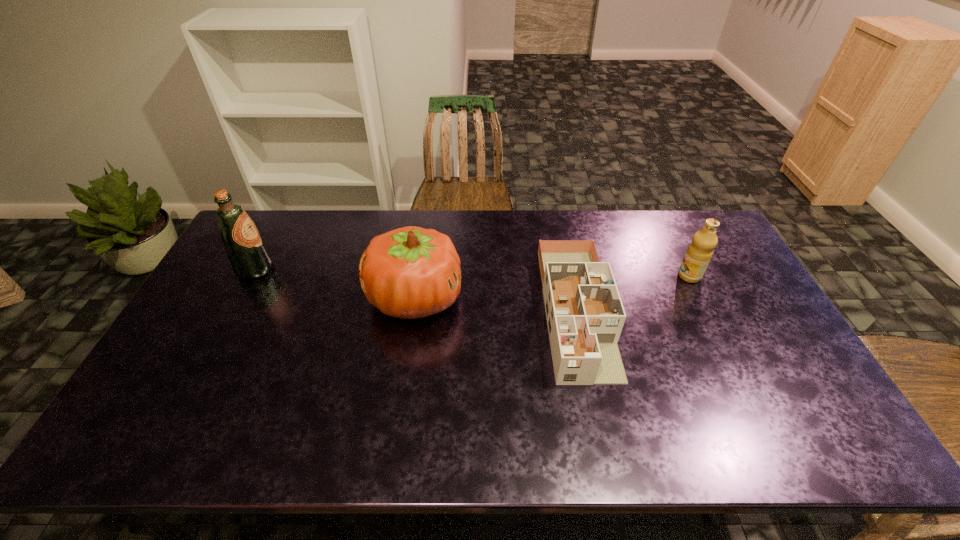
I want to click on free space located 0.200m on the label of the rightmost object, so click(x=616, y=276).

The height and width of the screenshot is (540, 960). What are the coordinates of `free space located 0.170m on the label of the rightmost object` in the screenshot? It's located at (626, 276).

At what (x,y) coordinates should I click in order to perform the action: click on free spot located 0.100m at the entrance of the third object from left to right. Please return your answer as a coordinate pair (x, y). Looking at the image, I should click on (600, 421).

Identify the location of object that is positioned at the left edge. (249, 256).

Find the location of a particular element. The image size is (960, 540). object located in the right edge section of the desktop is located at coordinates (699, 253).

This screenshot has height=540, width=960. Identify the location of free space at the far edge. (403, 220).

Locate an element on the screen. vacant area at the near edge is located at coordinates (297, 430).

Where is `free spot at the left edge of the desktop`? The image size is (960, 540). free spot at the left edge of the desktop is located at coordinates (224, 305).

I want to click on free space at the near left corner of the desktop, so click(181, 431).

In the image, there is a desktop. In order to click on vacant space at the far right corner in this screenshot , I will do `click(705, 212)`.